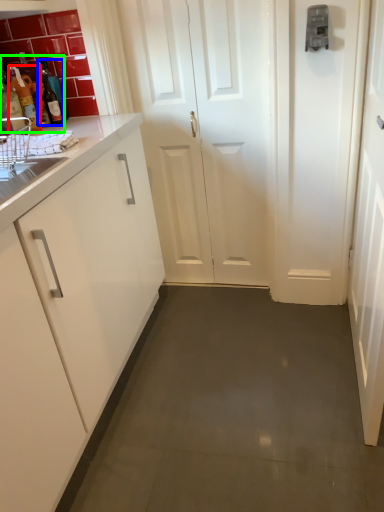
Question: Which object is the farthest from bottle (highlighted by a red box)? Choose among these: bottle (highlighted by a blue box) or bottle (highlighted by a green box).

Choices:
 (A) bottle
 (B) bottle

Answer: (A)